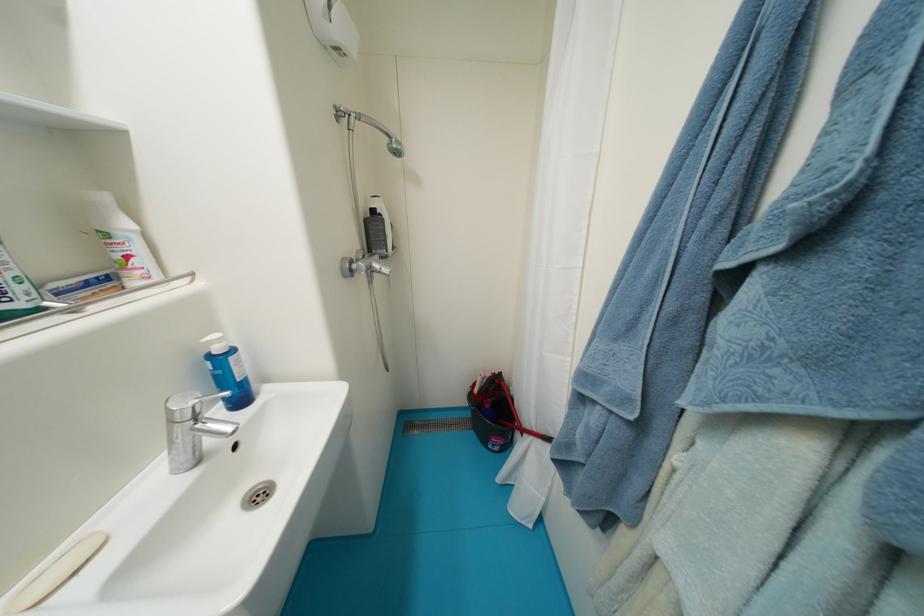
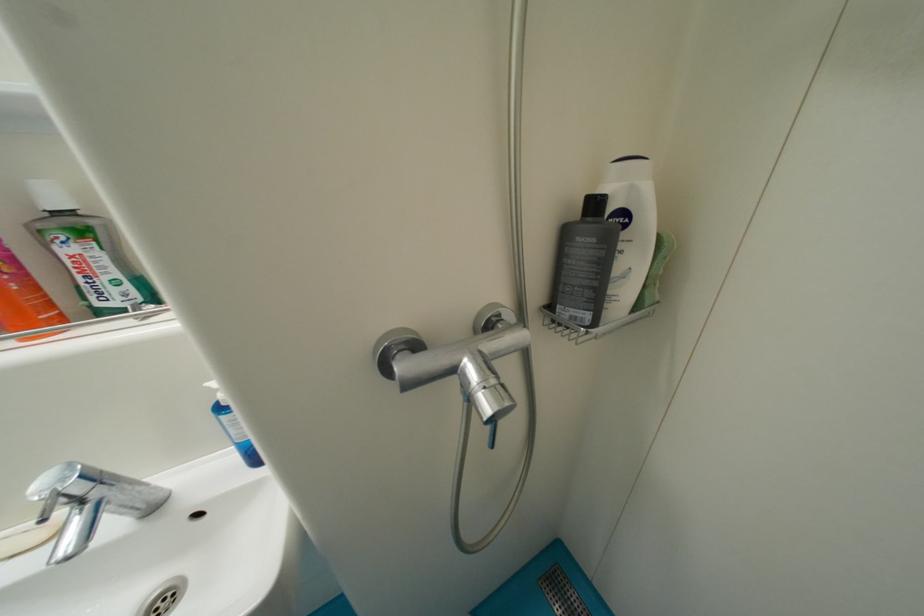
Question: The first image is from the beginning of the video and the second image is from the end. How did the camera likely rotate when shooting the video?

Choices:
 (A) Left
 (B) Right
 (C) Up
 (D) Down

Answer: (A)